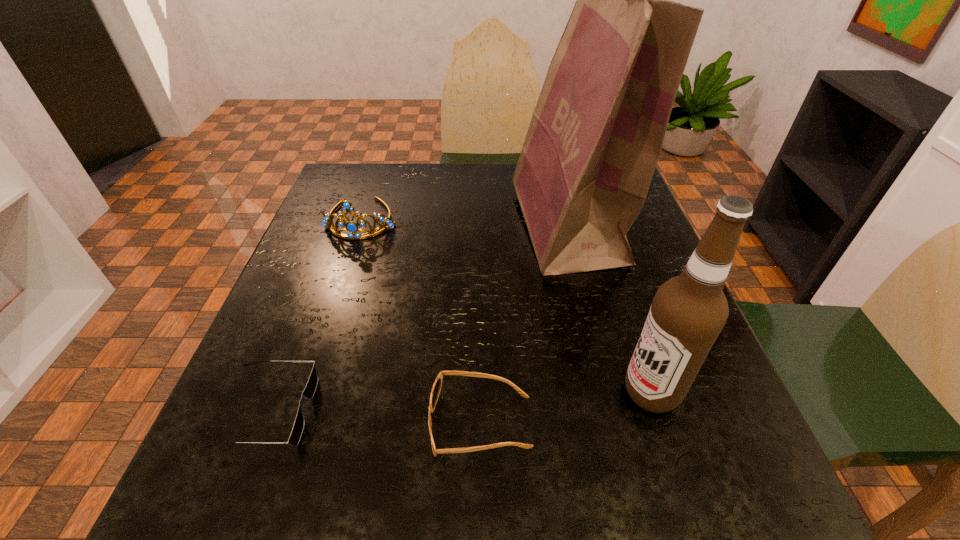
Find the location of a particular element. grocery bag is located at coordinates (593, 143).

Find the location of `alcohol`. alcohol is located at coordinates (688, 312).

The height and width of the screenshot is (540, 960). In order to click on the third tallest object in this screenshot , I will do tap(351, 227).

Where is `the taller sunglasses`? The image size is (960, 540). the taller sunglasses is located at coordinates (437, 385).

You are a GUI agent. You are given a task and a screenshot of the screen. Output one action in this format:
    pyautogui.click(x=<x>, y=<y>)
    Task: Click on the third object from left to right
    
    Given the screenshot: What is the action you would take?
    pyautogui.click(x=437, y=385)

This screenshot has height=540, width=960. I want to click on the shorter sunglasses, so click(310, 389).

Where is `the left sunglasses`? the left sunglasses is located at coordinates (310, 389).

Where is `vacant area situated 0.230m on the front-facing side of the tallest object`? vacant area situated 0.230m on the front-facing side of the tallest object is located at coordinates (420, 227).

Locate an element on the screen. vacant area situated 0.120m on the front-facing side of the tallest object is located at coordinates (466, 227).

Where is `vacant space located 0.280m on the front-facing side of the tallest object`? vacant space located 0.280m on the front-facing side of the tallest object is located at coordinates (399, 227).